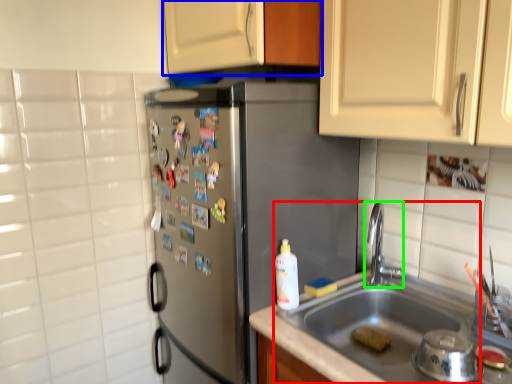
Question: Which object is the farthest from sink (highlighted by a red box)? Choose among these: cabinetry (highlighted by a blue box) or tap (highlighted by a green box).

Choices:
 (A) cabinetry
 (B) tap

Answer: (A)